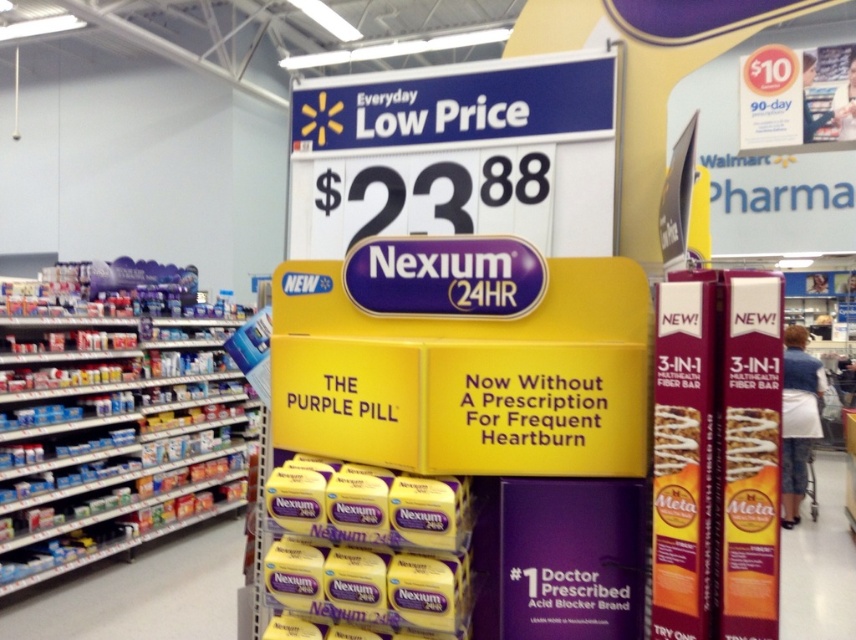
Question: Observing the image, what is the correct spatial positioning of yellow matte nexium 24hr at center in reference to white fabric shopping cart at right?

Choices:
 (A) right
 (B) left

Answer: (B)

Question: Is matte plastic shelves at left positioned in front of white fabric shopping cart at right?

Choices:
 (A) no
 (B) yes

Answer: (B)

Question: Which of the following is the farthest from the observer?

Choices:
 (A) matte plastic shelves at left
 (B) yellow matte nexium 24hr at center

Answer: (A)

Question: Which of the following is the farthest from the observer?

Choices:
 (A) matte plastic shelves at left
 (B) yellow matte nexium 24hr at center

Answer: (A)

Question: Can you confirm if yellow matte nexium 24hr at center is positioned to the right of white fabric shopping cart at right?

Choices:
 (A) no
 (B) yes

Answer: (A)

Question: Which of the following is the closest to the observer?

Choices:
 (A) white fabric shopping cart at right
 (B) matte plastic shelves at left

Answer: (B)